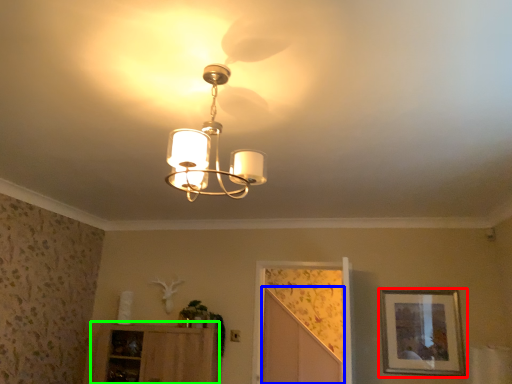
Question: Which object is positioned farthest from picture frame (highlighted by a red box)? Select from screen door (highlighted by a blue box) and cabinetry (highlighted by a green box).

Choices:
 (A) screen door
 (B) cabinetry

Answer: (B)